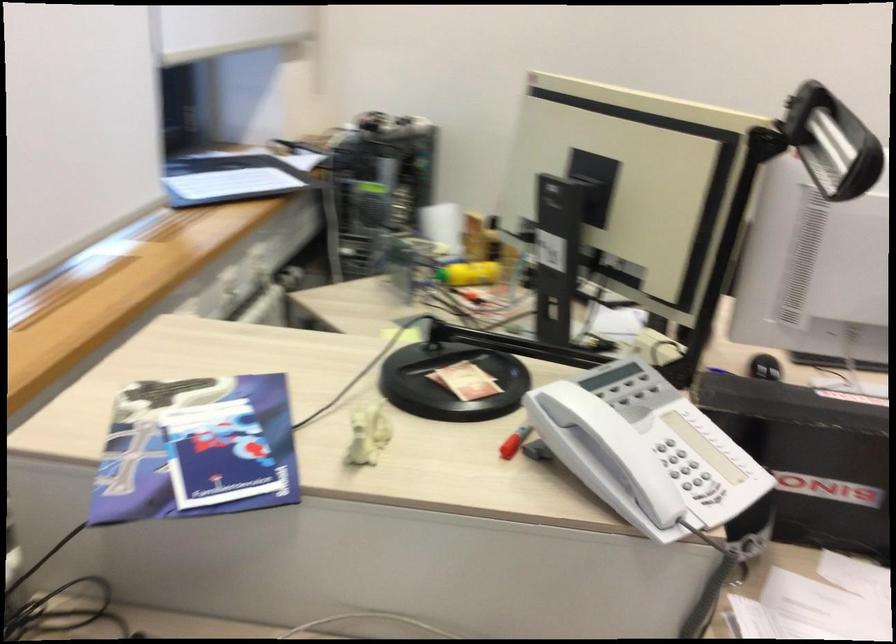
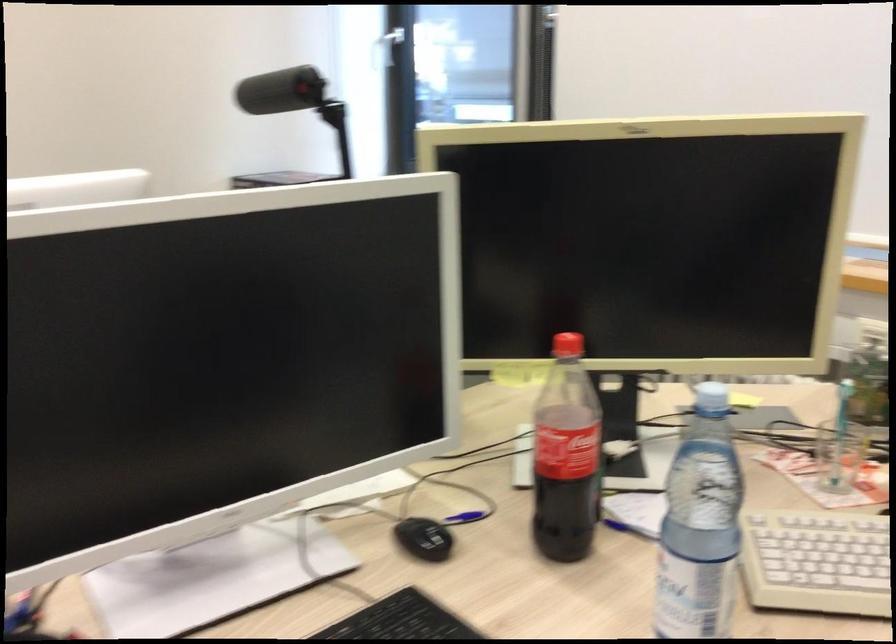
Question: I am providing you with two images of the same scene from different viewpoints. Which of the following objects are not visible in image2?

Choices:
 (A) black stepladder handle
 (B) black computer mouse
 (C) white phone handset
 (D) black microphone

Answer: (C)